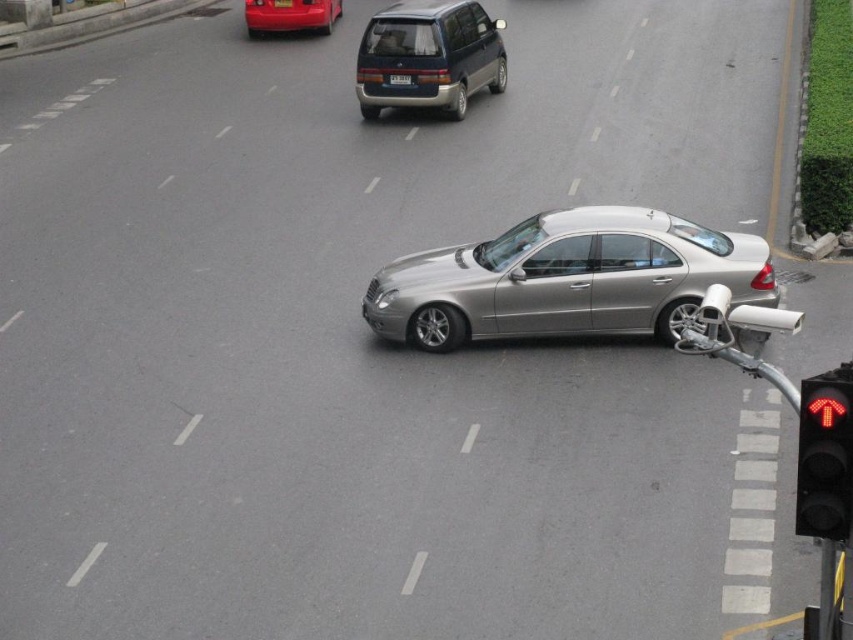
In the scene shown: You are driving a car and see the red glass traffic light at lower right and the shiny red car at upper center. How far apart are these two objects?

The distance between the red glass traffic light at lower right and the shiny red car at upper center is 20.97 meters.

You are a pedestrian waiting to cross the road. You see the satin silver car at center and the red glass traffic light at lower right. According to the traffic rules, which object should you pay attention to first before crossing?

You should pay attention to the red glass traffic light at lower right first because it indicates the traffic signal, and the satin silver car at center is above it, meaning the car is positioned closer to the traffic light, possibly waiting at the signal. Following traffic rules, pedestrians must obey traffic lights before crossing.

You are a driver approaching the intersection and see the red glass traffic light at lower right and the shiny red car at upper center. Which object is smaller in size?

The red glass traffic light at lower right is smaller in size compared to the shiny red car at upper center.